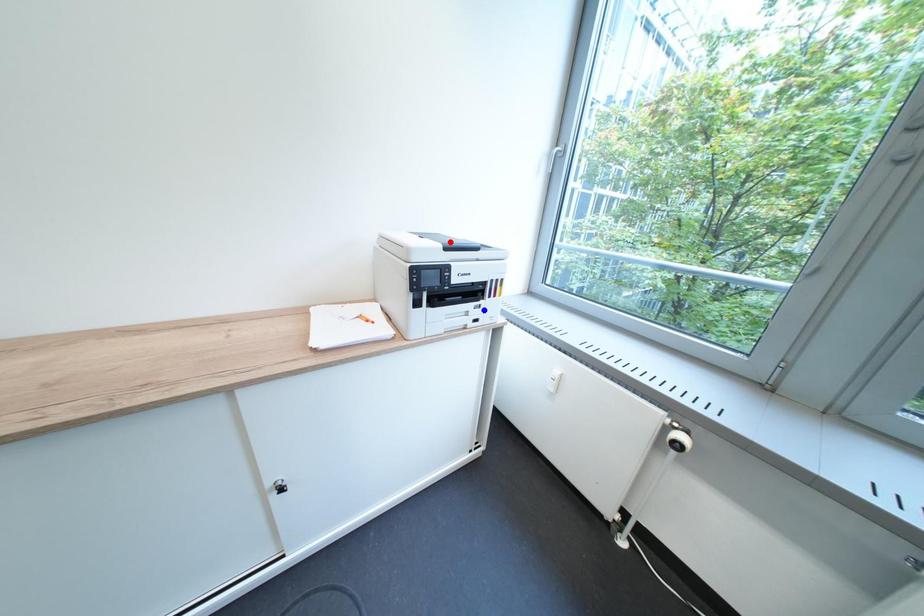
Question: Which of the two points in the image is closer to the camera?

Choices:
 (A) Blue point is closer.
 (B) Red point is closer.

Answer: (B)